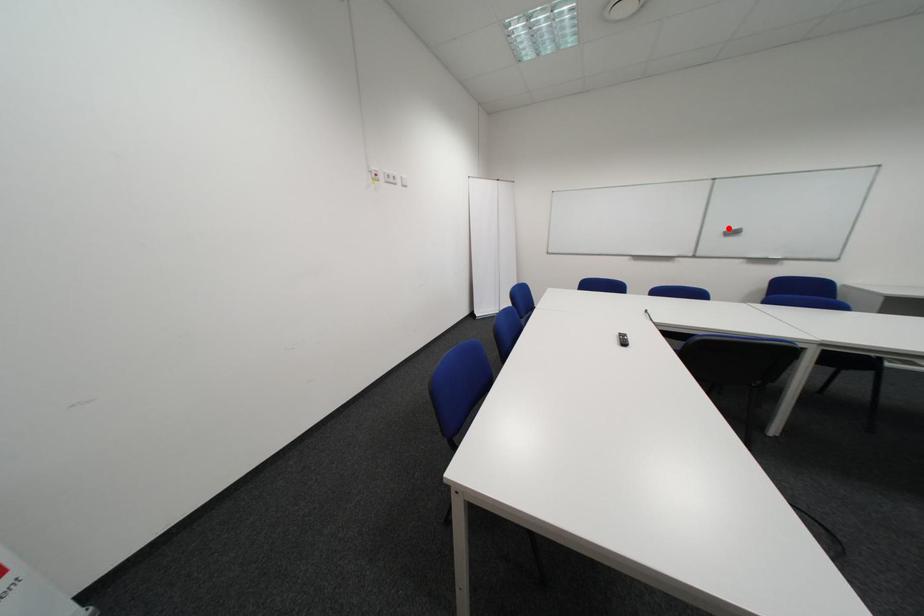
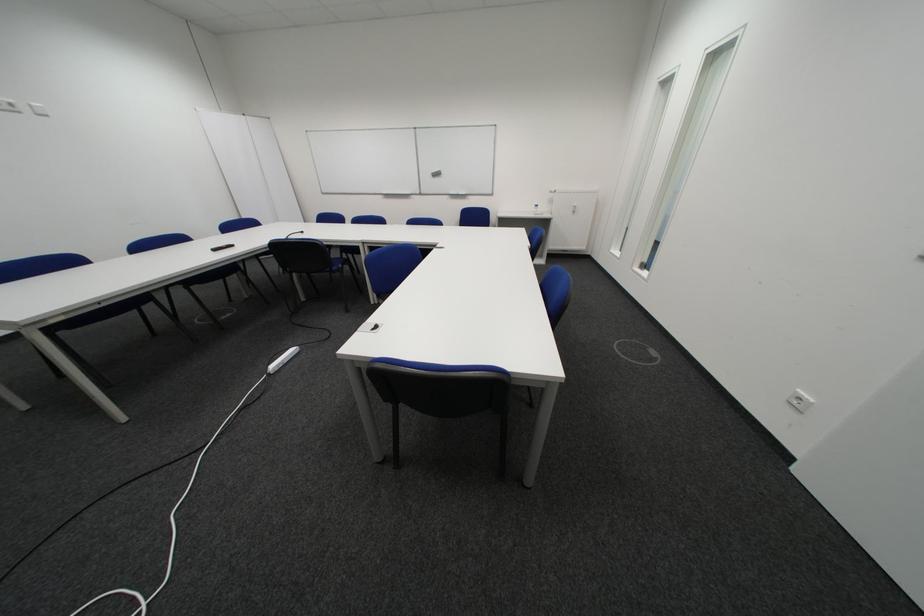
Question: I am providing you with two images of the same scene from different viewpoints. In image1, a red point is highlighted. Considering the same 3D point in image2, which of the following is correct?

Choices:
 (A) It is closer
 (B) It is farther

Answer: (A)